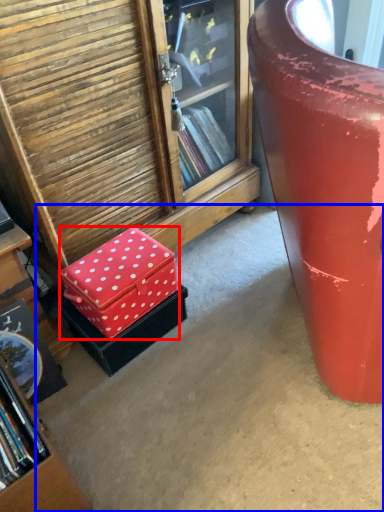
Question: Which object is further to the camera taking this photo, box (highlighted by a red box) or concrete (highlighted by a blue box)?

Choices:
 (A) box
 (B) concrete

Answer: (A)